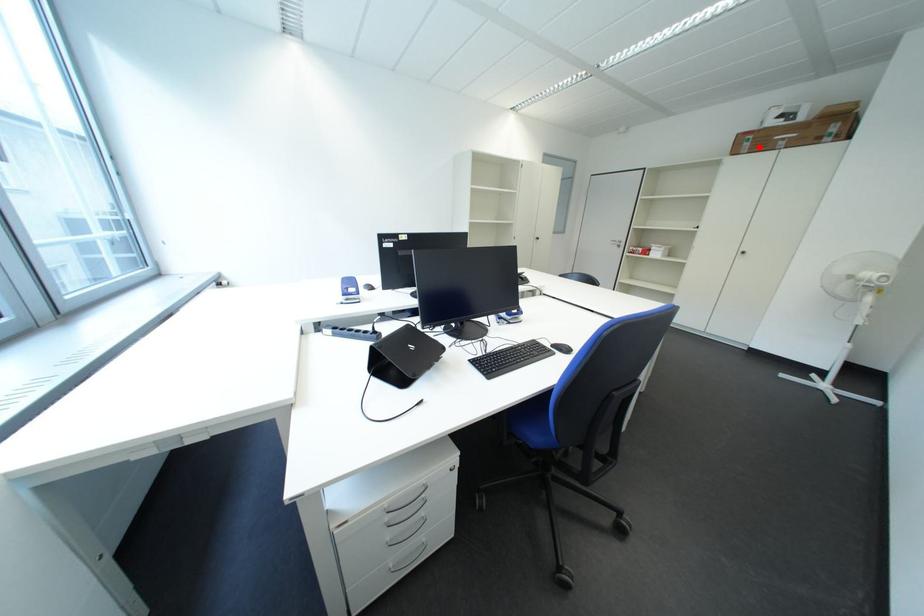
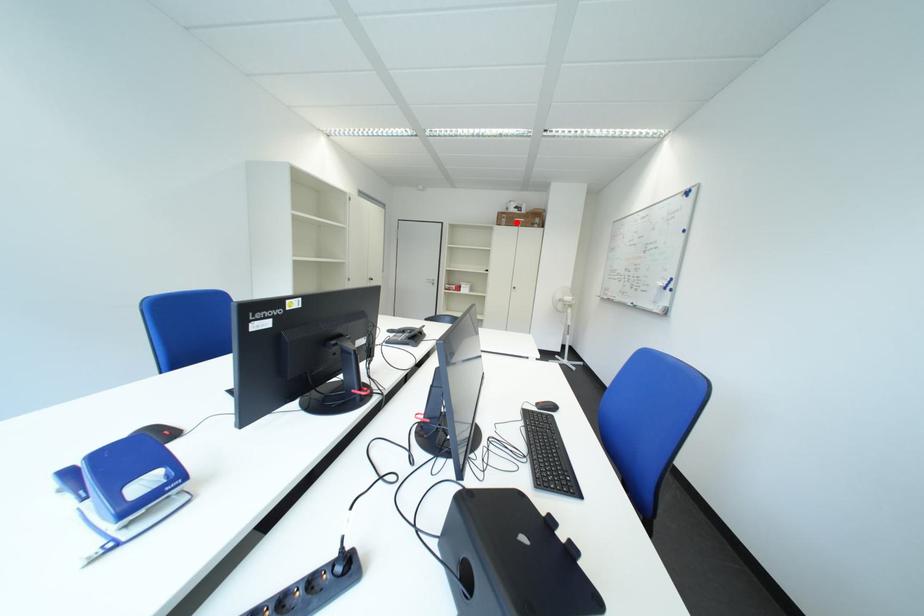
I am providing you with two images of the same scene from different viewpoints. A red point is marked on the first image and another point is marked on the second image. Does the point marked in image1 correspond to the same location as the one in image2?

Yes